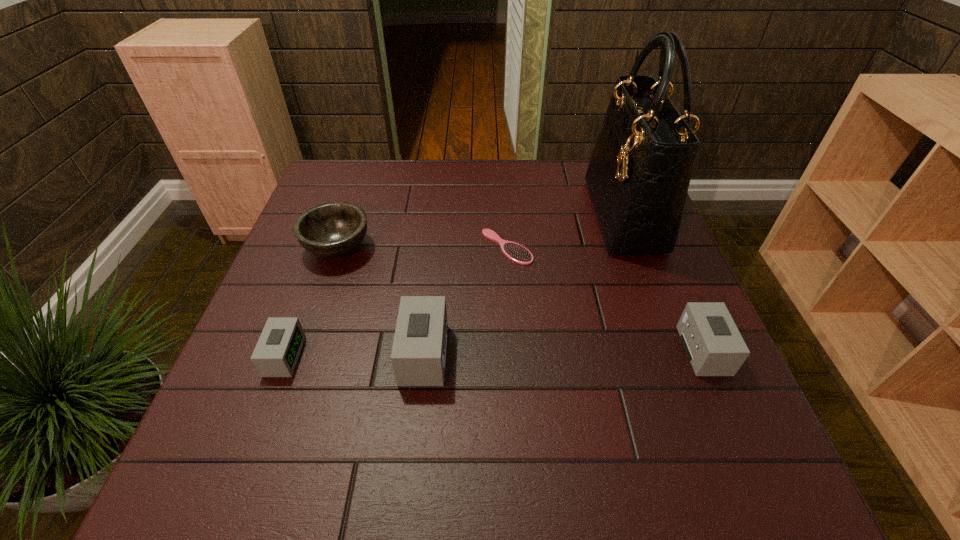
Where is `free region located on the front-facing side of the third object from left to right`? free region located on the front-facing side of the third object from left to right is located at coordinates (259, 354).

Identify the location of free space located 0.090m on the front-facing side of the third object from left to right. This screenshot has height=540, width=960. (358, 354).

Locate an element on the screen. This screenshot has height=540, width=960. vacant point located on the front-facing side of the third object from left to right is located at coordinates (270, 354).

You are a GUI agent. You are given a task and a screenshot of the screen. Output one action in this format:
    pyautogui.click(x=<x>, y=<y>)
    Task: Click on the vacant region located at the front of the tallest object with visible charms
    The image size is (960, 540).
    Given the screenshot: What is the action you would take?
    551,215

The width and height of the screenshot is (960, 540). I want to click on vacant area located 0.230m at the front of the tallest object with visible charms, so click(511, 215).

Where is `free location located 0.400m at the front of the tallest object with visible charms`? free location located 0.400m at the front of the tallest object with visible charms is located at coordinates (450, 215).

Where is `free space located 0.270m on the front of the shortest object`? This screenshot has width=960, height=540. free space located 0.270m on the front of the shortest object is located at coordinates (515, 357).

Locate an element on the screen. The height and width of the screenshot is (540, 960). free space located on the front of the bowl is located at coordinates (324, 289).

Identify the location of object positioned at the far edge. The height and width of the screenshot is (540, 960). (639, 173).

Locate an element on the screen. The image size is (960, 540). alarm clock present at the left edge is located at coordinates (277, 351).